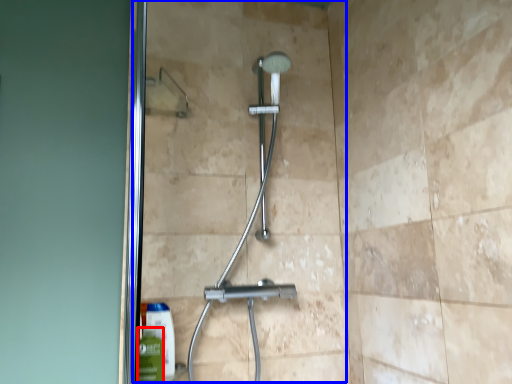
Question: Which object appears closest to the camera in this image, mouthwash (highlighted by a red box) or glass door (highlighted by a blue box)?

Choices:
 (A) mouthwash
 (B) glass door

Answer: (A)